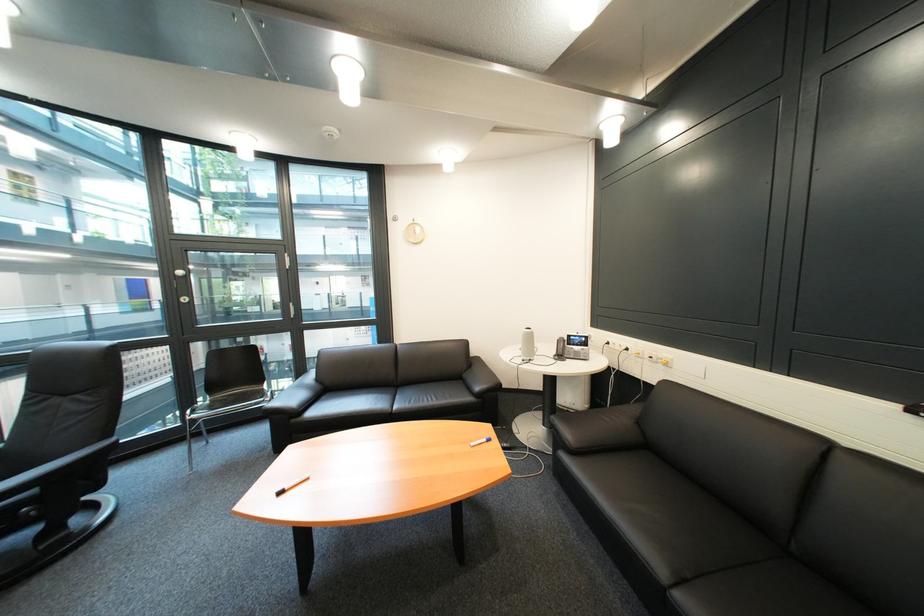
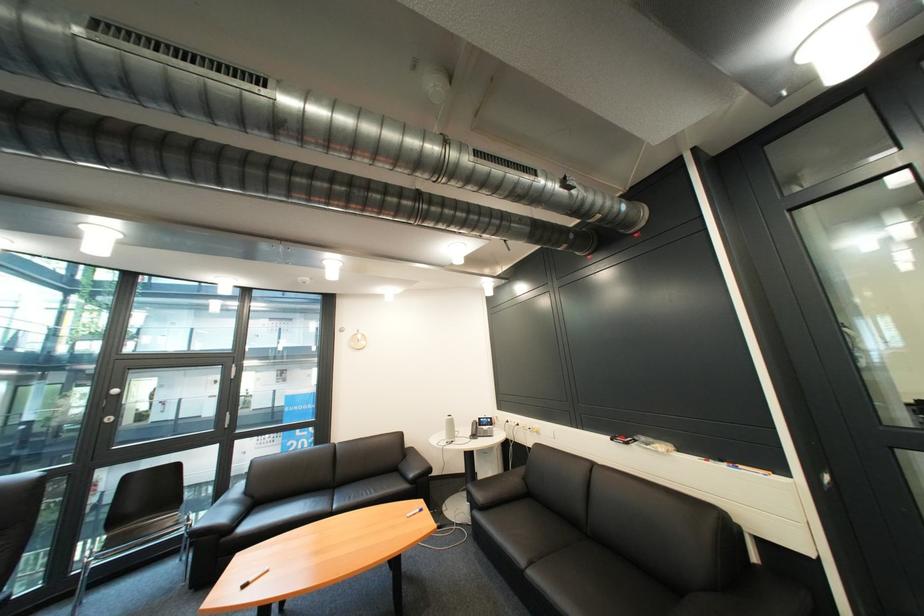
Find the pixel in the second image that matches (x=333, y=389) in the first image.

(262, 503)